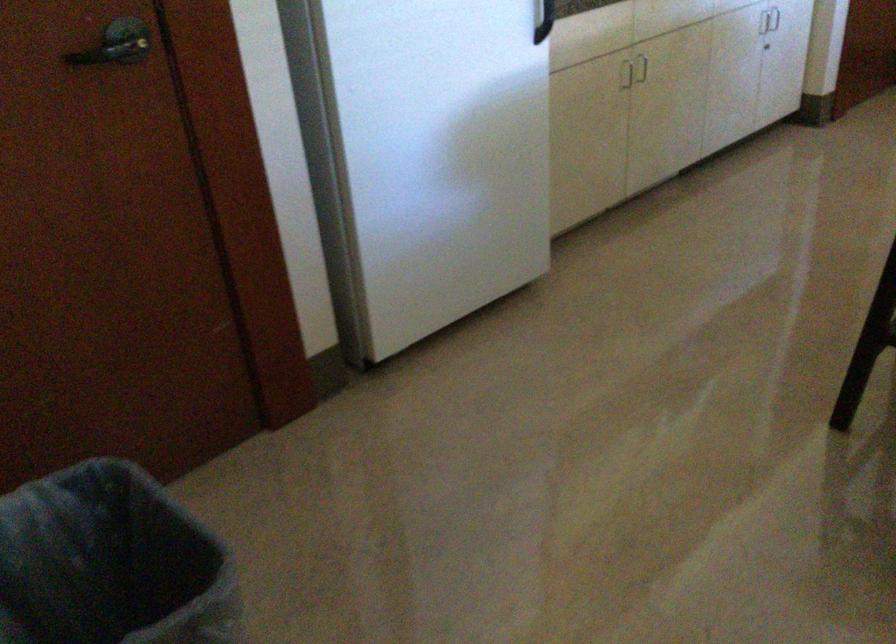
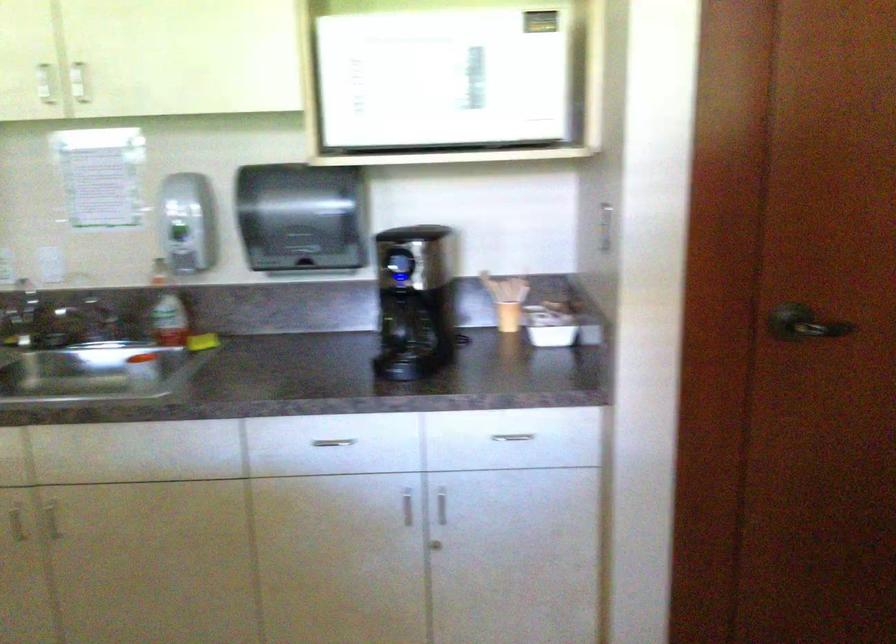
Where in the second image is the point corresponding to pixel 633 88 from the first image?

(15, 522)